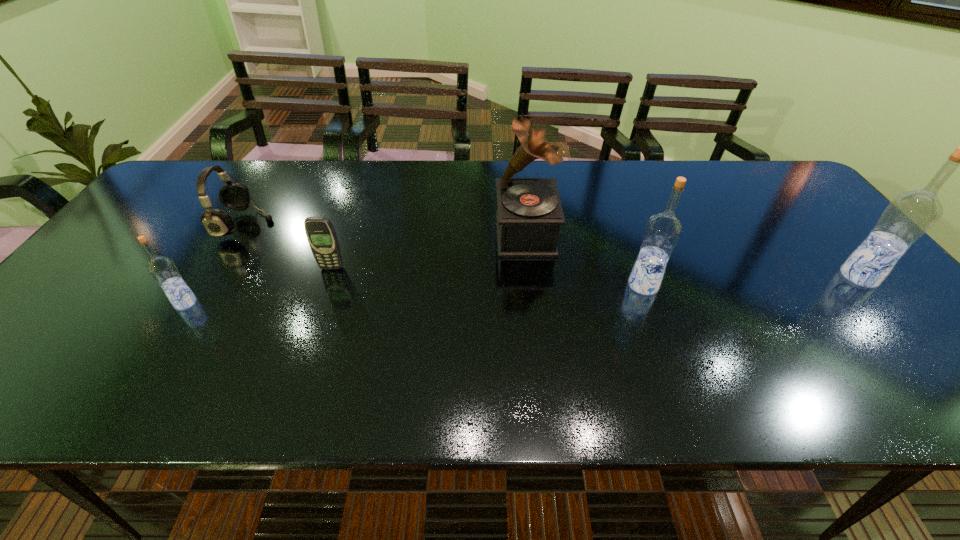
If the aim is uniform spacing by inserting an additional vodka among them, please point to a vacant space for this new vodka. Please provide its 2D coordinates. Your answer should be formatted as a tuple, i.e. [(x, y)], where the tuple contains the x and y coordinates of a point satisfying the conditions above.

[(419, 294)]